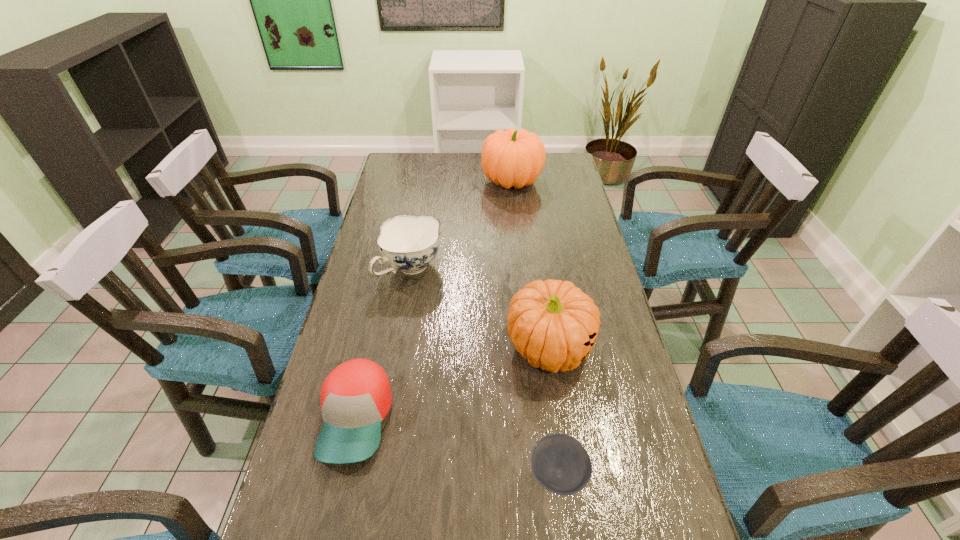
At what (x,y) coordinates should I click in order to perform the action: click on vacant region located on the left of the bowl. Please return your answer as a coordinate pair (x, y). Looking at the image, I should click on (424, 474).

At what (x,y) coordinates should I click in order to perform the action: click on object that is at the far edge. Please return your answer as a coordinate pair (x, y). This screenshot has width=960, height=540. Looking at the image, I should click on (510, 158).

Identify the location of chinaware that is at the left edge. This screenshot has height=540, width=960. (408, 243).

Find the location of a particular element. The width and height of the screenshot is (960, 540). baseball cap at the left edge is located at coordinates coord(355,398).

I want to click on object that is positioned at the far right corner, so [x=510, y=158].

I want to click on vacant space at the far edge of the desktop, so click(x=473, y=163).

This screenshot has height=540, width=960. What are the coordinates of `blank area at the left edge` in the screenshot? It's located at (371, 250).

In the image, there is a desktop. Find the location of `free space at the right edge`. free space at the right edge is located at coordinates (543, 195).

Find the location of a particular element. The height and width of the screenshot is (540, 960). vacant area at the far left corner is located at coordinates (404, 159).

Locate an element on the screen. free spot between the chinaware and the bowl is located at coordinates (485, 372).